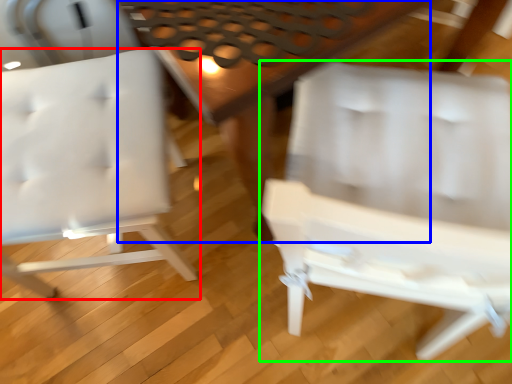
Question: Estimate the real-world distances between objects in this image. Which object is closer to chair (highlighted by a red box), table (highlighted by a blue box) or chair (highlighted by a green box)?

Choices:
 (A) table
 (B) chair

Answer: (A)